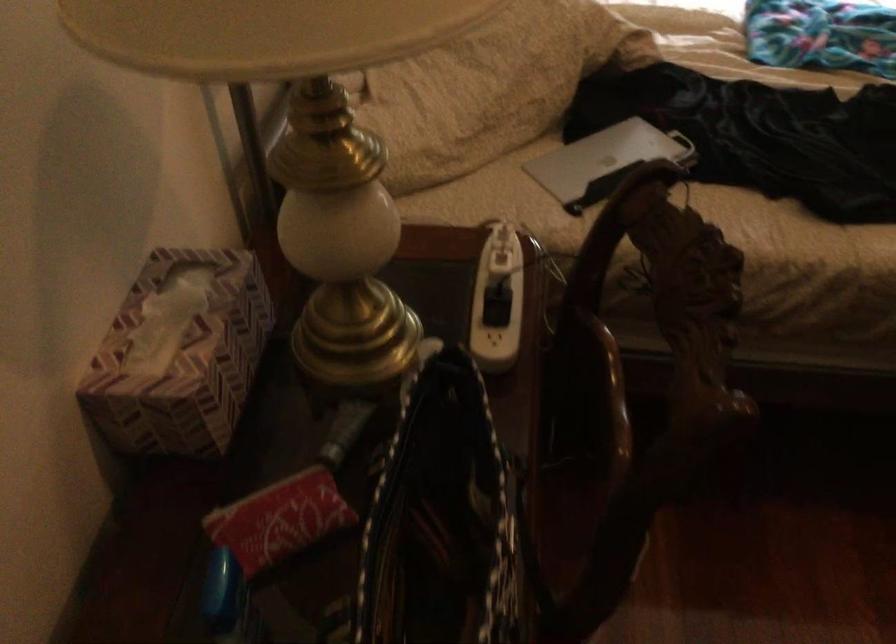
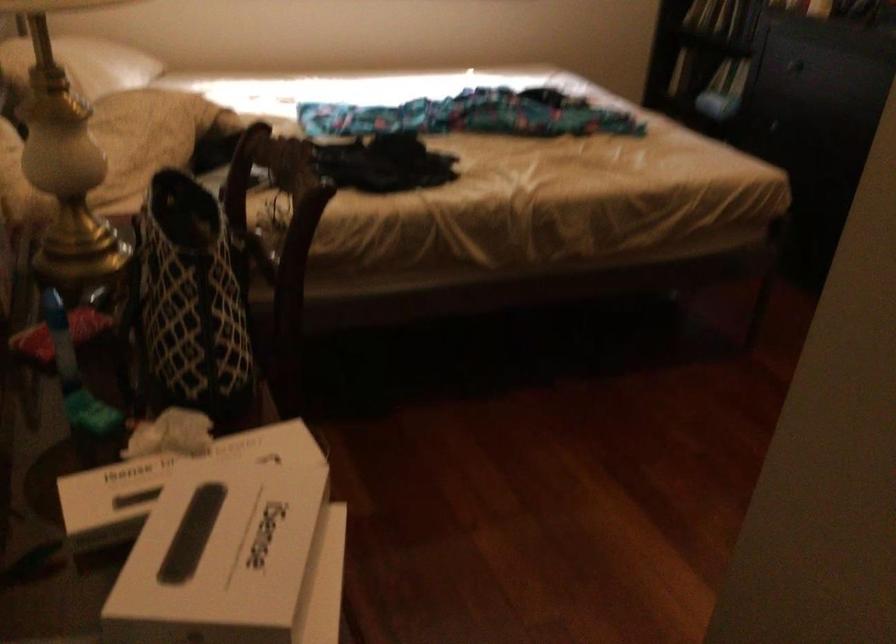
Question: How did the camera likely rotate?

Choices:
 (A) Left
 (B) Right
 (C) Up
 (D) Down

Answer: (B)